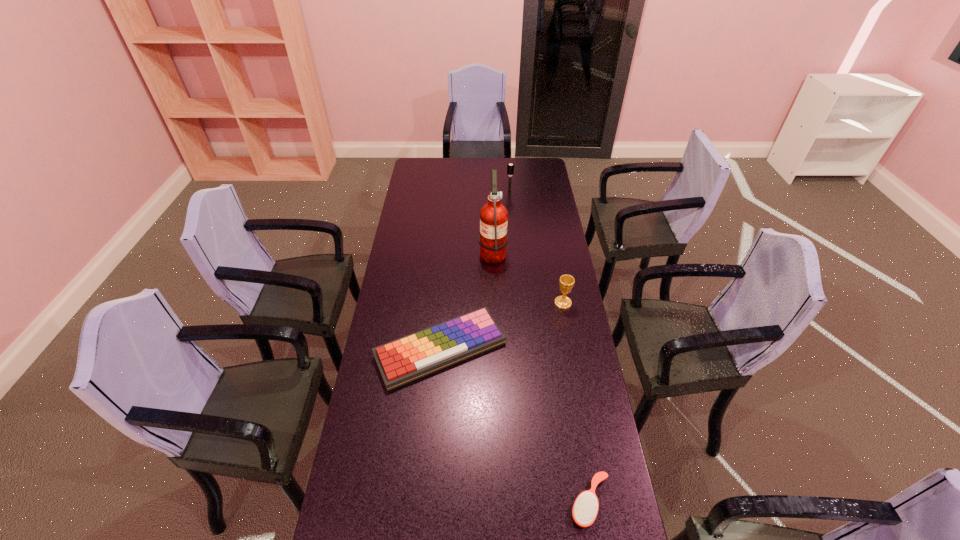
In order to click on the tallest object in this screenshot , I will do `click(493, 238)`.

The image size is (960, 540). Identify the location of fire extinguisher. (493, 238).

In order to click on the third object from left to right in this screenshot , I will do `click(510, 167)`.

Image resolution: width=960 pixels, height=540 pixels. Find the location of `the taller hairbrush`. the taller hairbrush is located at coordinates (510, 167).

The height and width of the screenshot is (540, 960). Find the location of `chalice`. chalice is located at coordinates (566, 282).

Where is `computer keyboard`? Image resolution: width=960 pixels, height=540 pixels. computer keyboard is located at coordinates (406, 359).

Identify the location of the right hairbrush. (585, 509).

The width and height of the screenshot is (960, 540). Identify the location of the nearest object. (585, 509).

What are the coordinates of `free space located on the nozzle and handle of the fire extinguisher` in the screenshot? It's located at (432, 251).

You are a GUI agent. You are given a task and a screenshot of the screen. Output one action in this format:
    pyautogui.click(x=<x>, y=<y>)
    Task: Click on the free space located 0.310m on the nozzle and handle of the fire extinguisher
    
    Given the screenshot: What is the action you would take?
    pyautogui.click(x=410, y=251)